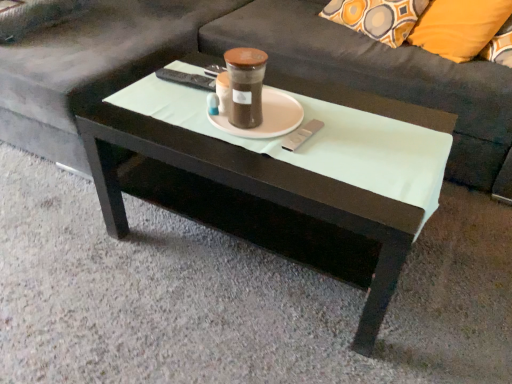
Where is `vacant space to the right of white matte saucer at center`? The height and width of the screenshot is (384, 512). vacant space to the right of white matte saucer at center is located at coordinates (347, 129).